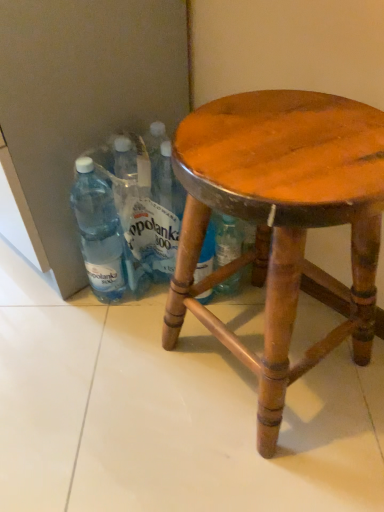
Where is `free space above wooden stool at center (from a real-world perspective)`? This screenshot has height=512, width=384. free space above wooden stool at center (from a real-world perspective) is located at coordinates (277, 134).